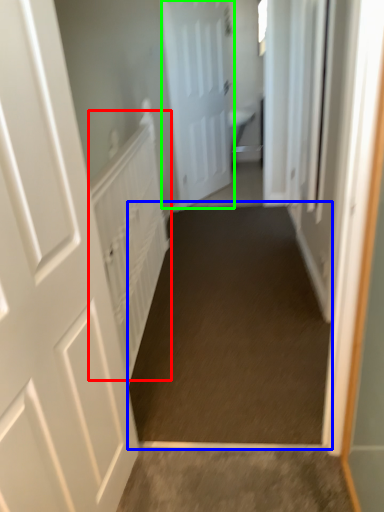
Question: Based on their relative distances, which object is nearer to radiator (highlighted by a red box)? Choose from path (highlighted by a blue box) and door (highlighted by a green box).

Choices:
 (A) path
 (B) door

Answer: (A)